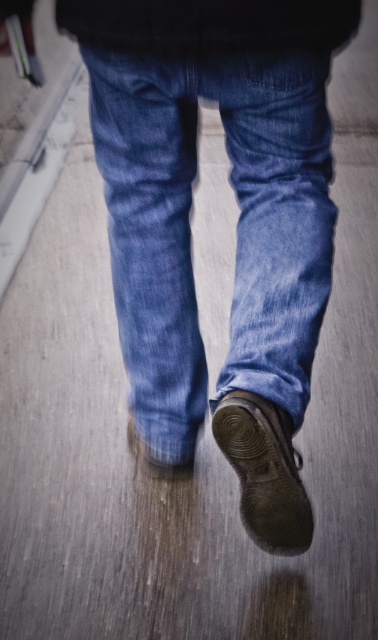
Question: Which of these objects is positioned farthest from the denim jeans at center?

Choices:
 (A) leather textured shoe at lower center
 (B) matte brown leather shoe at lower center

Answer: (B)

Question: Which point is closer to the camera taking this photo?

Choices:
 (A) tap(139, 456)
 (B) tap(244, 432)
 (C) tap(291, 410)

Answer: (B)

Question: Is denim jeans at center to the left of matte brown leather shoe at lower center from the viewer's perspective?

Choices:
 (A) yes
 (B) no

Answer: (B)

Question: Does denim jeans at center appear on the right side of matte brown leather shoe at lower center?

Choices:
 (A) yes
 (B) no

Answer: (A)

Question: Can you confirm if leather textured shoe at lower center is thinner than matte brown leather shoe at lower center?

Choices:
 (A) yes
 (B) no

Answer: (B)

Question: Which point is farther from the camera taking this photo?

Choices:
 (A) (148, 138)
 (B) (187, 474)
 (C) (240, 397)

Answer: (B)